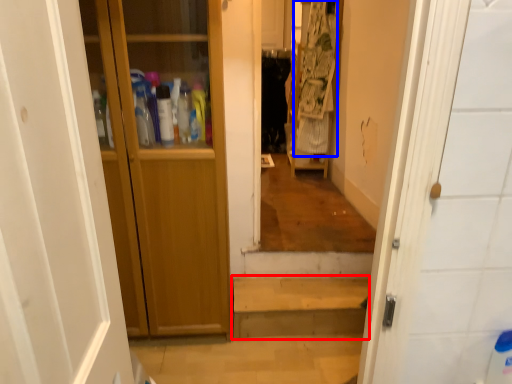
Question: Among these objects, which one is farthest to the camera, stairwell (highlighted by a red box) or laundry (highlighted by a blue box)?

Choices:
 (A) stairwell
 (B) laundry

Answer: (B)